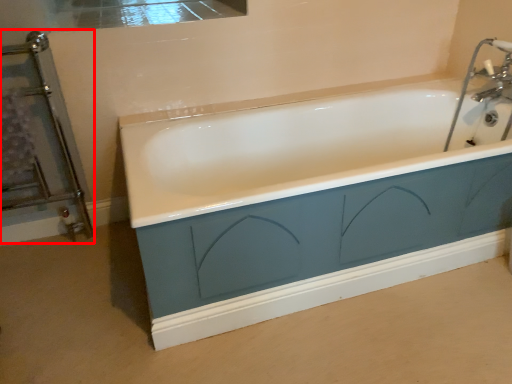
Question: Considering the relative positions of screen door (annotated by the red box) and sink in the image provided, where is screen door (annotated by the red box) located with respect to the staircase?

Choices:
 (A) right
 (B) left

Answer: (B)